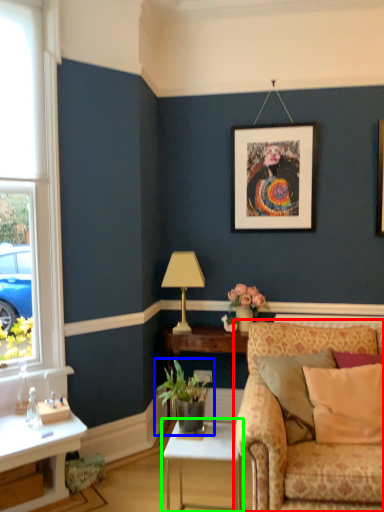
Question: Which object is positioned closest to studio couch (highlighted by a red box)? Select from houseplant (highlighted by a blue box) and table (highlighted by a green box).

Choices:
 (A) houseplant
 (B) table

Answer: (B)